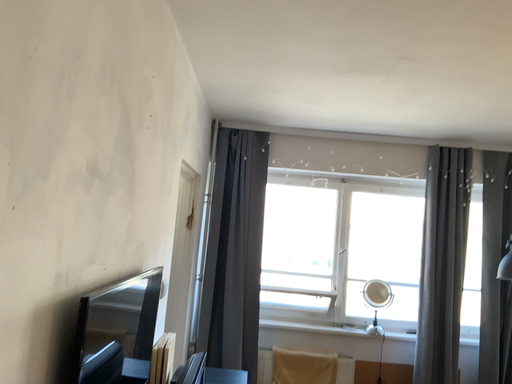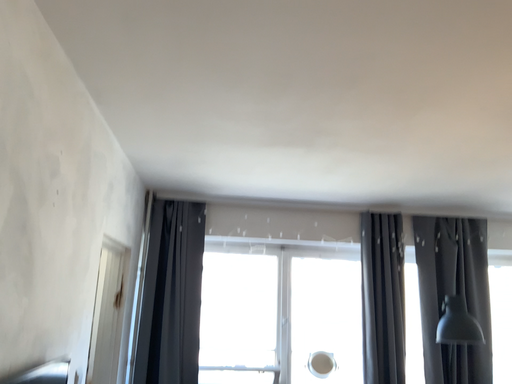
Question: Which way did the camera rotate in the video?

Choices:
 (A) rotated upward
 (B) rotated downward

Answer: (A)